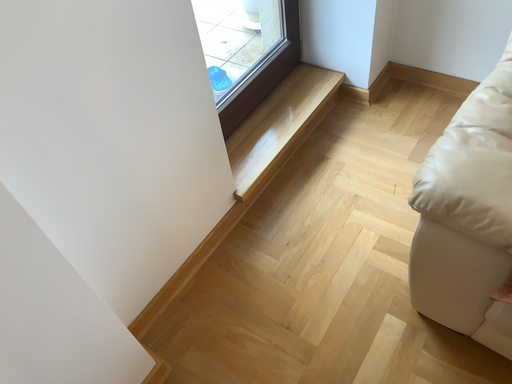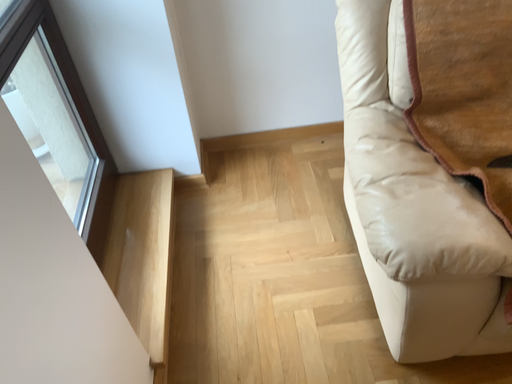
Question: How did the camera likely rotate when shooting the video?

Choices:
 (A) rotated downward
 (B) rotated upward

Answer: (B)